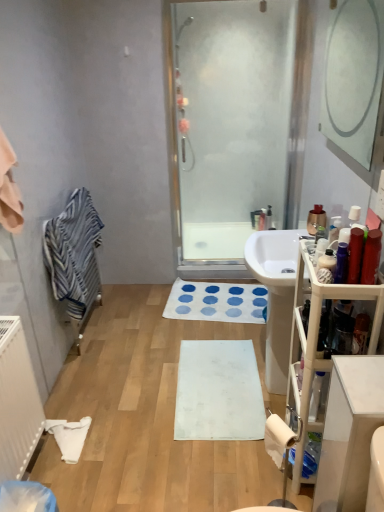
Find the location of a particular element. free space above white matte rug at center (from a real-world perspective) is located at coordinates (168, 360).